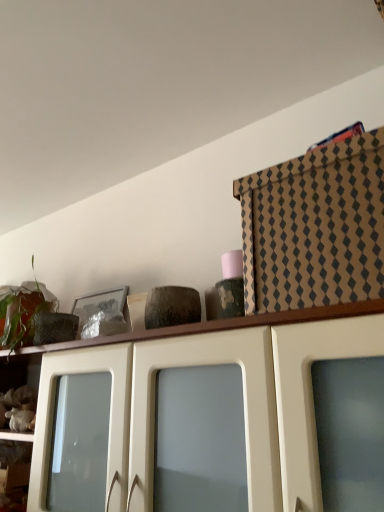
Question: Is brown cardboard box at upper right, which ranks as the 1th cabinetry in top-to-bottom order, surrounding green matte plant at upper left?

Choices:
 (A) yes
 (B) no

Answer: (B)

Question: From a real-world perspective, is brown cardboard box at upper right, placed as the 2th cabinetry when sorted from bottom to top, on top of green matte plant at upper left?

Choices:
 (A) no
 (B) yes

Answer: (B)

Question: Is brown cardboard box at upper right, placed as the 2th cabinetry when sorted from bottom to top, positioned far away from green matte plant at upper left?

Choices:
 (A) no
 (B) yes

Answer: (A)

Question: Considering the relative positions of brown cardboard box at upper right, placed as the 2th cabinetry when sorted from bottom to top, and green matte plant at upper left in the image provided, is brown cardboard box at upper right, placed as the 2th cabinetry when sorted from bottom to top, to the left of green matte plant at upper left from the viewer's perspective?

Choices:
 (A) yes
 (B) no

Answer: (B)

Question: Is brown cardboard box at upper right, which ranks as the 1th cabinetry in top-to-bottom order, positioned behind green matte plant at upper left?

Choices:
 (A) yes
 (B) no

Answer: (B)

Question: Would you say brown cardboard box at upper right, which ranks as the 1th cabinetry in top-to-bottom order, is to the left or to the right of green matte plant at upper left in the picture?

Choices:
 (A) right
 (B) left

Answer: (A)

Question: In the image, is brown cardboard box at upper right, which ranks as the 1th cabinetry in top-to-bottom order, positioned in front of or behind green matte plant at upper left?

Choices:
 (A) behind
 (B) front

Answer: (B)

Question: Looking at their shapes, would you say brown cardboard box at upper right, which ranks as the 1th cabinetry in top-to-bottom order, is wider or thinner than green matte plant at upper left?

Choices:
 (A) thin
 (B) wide

Answer: (B)

Question: From a real-world perspective, is brown cardboard box at upper right, placed as the 2th cabinetry when sorted from bottom to top, positioned above or below green matte plant at upper left?

Choices:
 (A) below
 (B) above

Answer: (B)

Question: Is green matte plant at upper left inside or outside of brown cardboard box at upper right, placed as the 2th cabinetry when sorted from bottom to top?

Choices:
 (A) outside
 (B) inside

Answer: (A)

Question: Is green matte plant at upper left taller or shorter than brown cardboard box at upper right, placed as the 2th cabinetry when sorted from bottom to top?

Choices:
 (A) short
 (B) tall

Answer: (B)

Question: From the image's perspective, is green matte plant at upper left above or below brown cardboard box at upper right, placed as the 2th cabinetry when sorted from bottom to top?

Choices:
 (A) above
 (B) below

Answer: (B)

Question: In the image, is green matte plant at upper left positioned in front of or behind brown cardboard box at upper right, placed as the 2th cabinetry when sorted from bottom to top?

Choices:
 (A) behind
 (B) front

Answer: (A)

Question: Is brown cardboard box at upper right, placed as the 2th cabinetry when sorted from bottom to top, inside or outside of matte white cabinet at upper center, arranged as the second cabinetry when viewed from the top?

Choices:
 (A) outside
 (B) inside

Answer: (A)

Question: Is point pos(276,309) closer or farther from the camera than point pos(52,352)?

Choices:
 (A) farther
 (B) closer

Answer: (B)